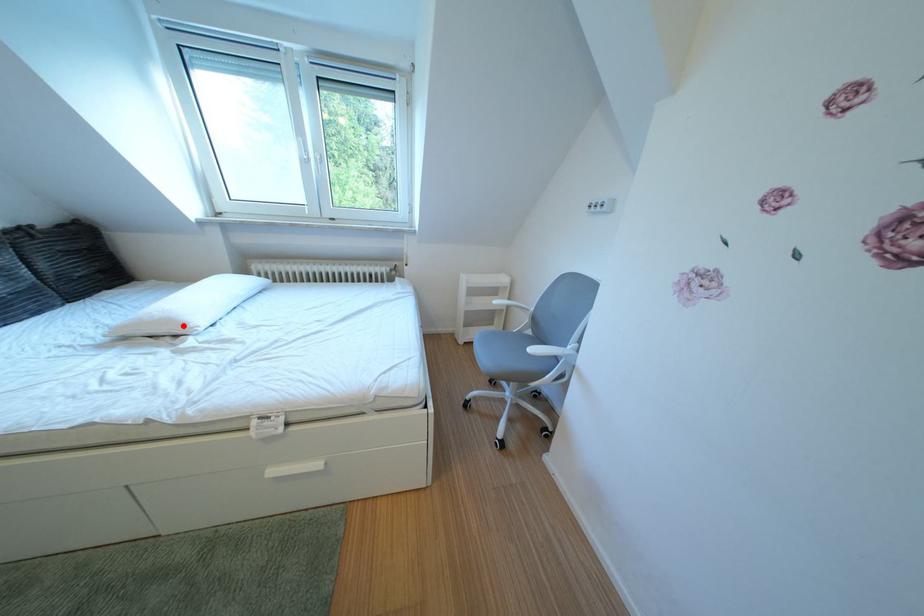
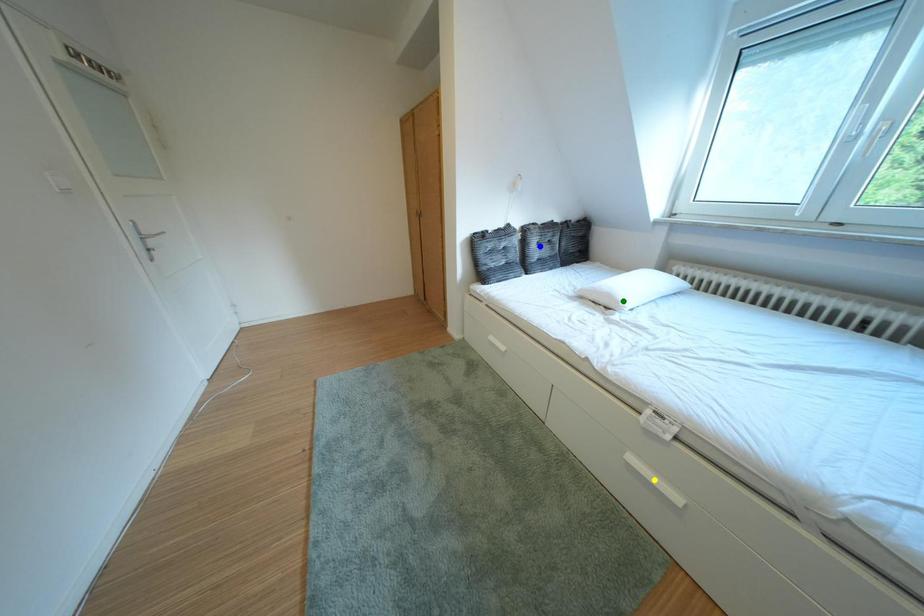
Question: I am providing you with two images of the same scene from different viewpoints. A red point is marked on the first image. You are given multiple points on the second image. Can you choose the point in image 2 that corresponds to the point in image 1?

Choices:
 (A) blue point
 (B) green point
 (C) yellow point

Answer: (B)